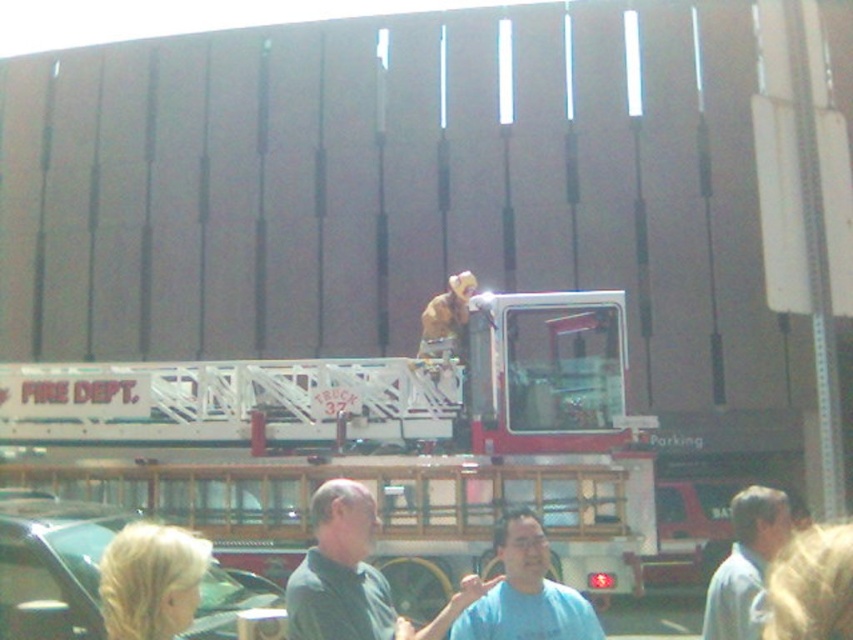
You are a construction worker standing at the edge of the construction site. You need to reach the top of the white metallic ladder at center to secure some equipment. Given that your safety harness can extend up to 12 meters, will you be able to safely reach the top?

The white metallic ladder at center is 10.36 meters away from the viewer. Since your safety harness can extend up to 12 meters, you will be able to safely reach the top of the white metallic ladder at center.